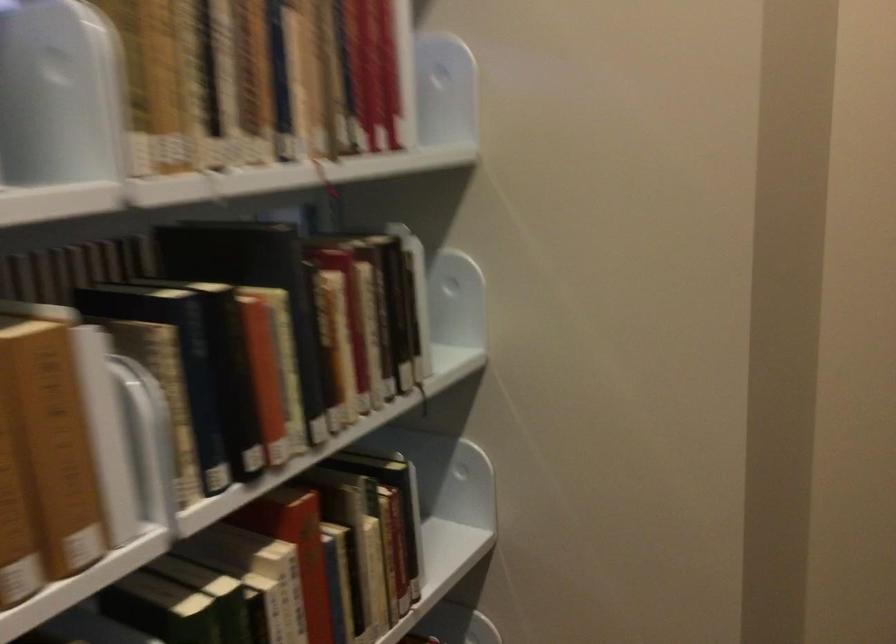
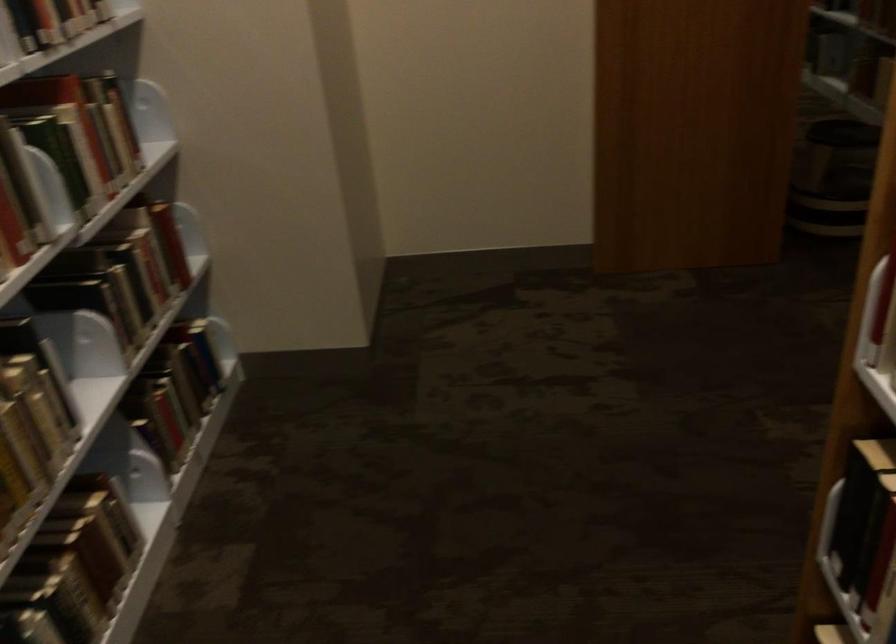
Where in the second image is the point corresponding to (287,424) from the first image?

(46, 24)